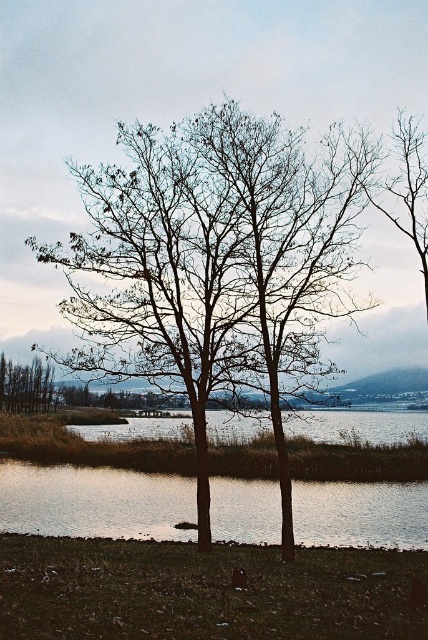
Can you confirm if reflective glass water at center is thinner than brown matte tree at left?

No, reflective glass water at center is not thinner than brown matte tree at left.

Find the location of a particular element. Image resolution: width=428 pixels, height=640 pixels. reflective glass water at center is located at coordinates (94, 500).

Identify the location of reflective glass water at center. (94, 500).

Measure the distance between bare branches at center and reflective glass water at center.

bare branches at center and reflective glass water at center are 24.56 feet apart from each other.

The image size is (428, 640). What do you see at coordinates (217, 262) in the screenshot?
I see `bare branches at center` at bounding box center [217, 262].

The height and width of the screenshot is (640, 428). What are the coordinates of `bare branches at center` in the screenshot? It's located at (217, 262).

Does bare branches at center have a greater height compared to brown matte tree at left?

Indeed, bare branches at center has a greater height compared to brown matte tree at left.

Consider the image. Measure the distance from bare branches at center to brown matte tree at left.

The distance of bare branches at center from brown matte tree at left is 26.61 meters.

Between point (183, 218) and point (0, 365), which one is positioned behind?

Point (0, 365)

At what (x,y) coordinates should I click in order to perform the action: click on bare branches at center. Please return your answer as a coordinate pair (x, y). The width and height of the screenshot is (428, 640). Looking at the image, I should click on (217, 262).